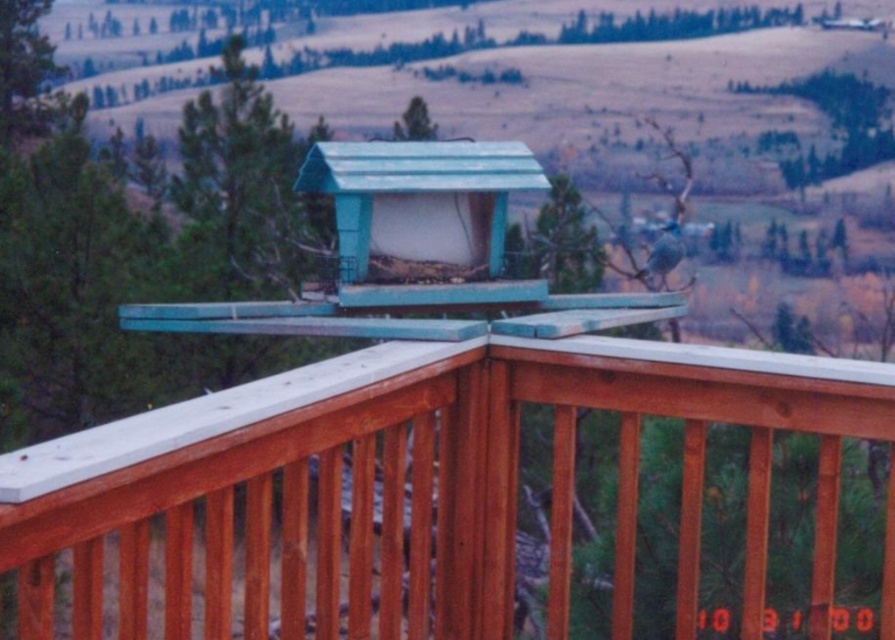
Question: Observing the image, what is the correct spatial positioning of wooden porch at center in reference to teal plastic bird feeder at center?

Choices:
 (A) left
 (B) right

Answer: (B)

Question: From the image, what is the correct spatial relationship of wooden porch at center in relation to teal plastic bird feeder at center?

Choices:
 (A) above
 (B) below

Answer: (B)

Question: Can you confirm if wooden porch at center is positioned above teal plastic bird feeder at center?

Choices:
 (A) yes
 (B) no

Answer: (B)